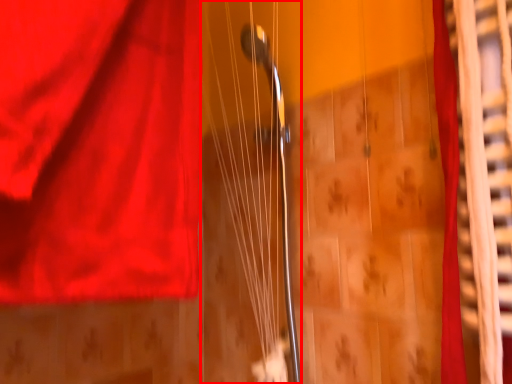
Question: From the image's perspective, where is string (annotated by the red box) located in relation to curtain in the image?

Choices:
 (A) below
 (B) above

Answer: (A)